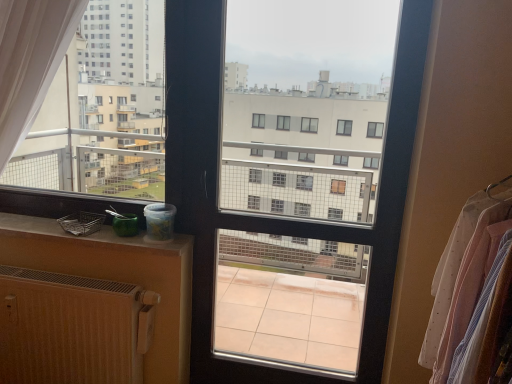
Question: Is wooden radiator at lower left positioned beyond the bounds of clear glass window screen at center?

Choices:
 (A) no
 (B) yes

Answer: (B)

Question: Can you confirm if wooden radiator at lower left is smaller than clear glass window screen at center?

Choices:
 (A) no
 (B) yes

Answer: (B)

Question: From a real-world perspective, does wooden radiator at lower left sit lower than clear glass window screen at center?

Choices:
 (A) no
 (B) yes

Answer: (B)

Question: Are wooden radiator at lower left and clear glass window screen at center making contact?

Choices:
 (A) no
 (B) yes

Answer: (A)

Question: Does wooden radiator at lower left turn towards clear glass window screen at center?

Choices:
 (A) yes
 (B) no

Answer: (B)

Question: Considering the relative positions of wooden radiator at lower left and clear glass window screen at center in the image provided, is wooden radiator at lower left to the left of clear glass window screen at center from the viewer's perspective?

Choices:
 (A) no
 (B) yes

Answer: (B)

Question: Is white sheer fabric at right wider than white matte plastic container at left?

Choices:
 (A) yes
 (B) no

Answer: (A)

Question: Is white sheer fabric at right positioned beyond the bounds of white matte plastic container at left?

Choices:
 (A) yes
 (B) no

Answer: (A)

Question: Is white sheer fabric at right bigger than white matte plastic container at left?

Choices:
 (A) yes
 (B) no

Answer: (A)

Question: Does white sheer fabric at right appear on the left side of white matte plastic container at left?

Choices:
 (A) no
 (B) yes

Answer: (A)

Question: From a real-world perspective, is white sheer fabric at right beneath white matte plastic container at left?

Choices:
 (A) yes
 (B) no

Answer: (A)

Question: Does white sheer fabric at right have a lesser width compared to white matte plastic container at left?

Choices:
 (A) yes
 (B) no

Answer: (B)

Question: Is clear glass window screen at center to the left of matte plastic container at lower left from the viewer's perspective?

Choices:
 (A) no
 (B) yes

Answer: (A)